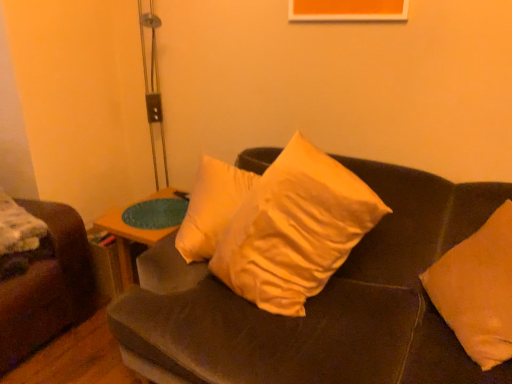
What do you see at coordinates (320, 303) in the screenshot?
I see `velvet brown couch at center` at bounding box center [320, 303].

In order to face orange fabric pillow at right, which is the 1th pillow from right to left, should I rotate leftwards or rightwards?

It's best to rotate right around 29.022 degrees.

Image resolution: width=512 pixels, height=384 pixels. In order to click on soft yellow pillow at center, placed as the 2th pillow when sorted from right to left in this screenshot , I will do `click(295, 229)`.

From the picture: Would you consider metallic silver table lamp at upper left to be distant from woodenwoodentable at center?

metallic silver table lamp at upper left is near woodenwoodentable at center, not far away.

Between point (143, 47) and point (154, 240), which one is positioned behind?

Positioned behind is point (143, 47).

Which object is further away from the camera taking this photo, metallic silver table lamp at upper left or woodenwoodentable at center?

metallic silver table lamp at upper left is behind.

Is orange fabric pillow at right, positioned as the second pillow in left-to-right order, inside the boundaries of metallic silver table lamp at upper left, or outside?

orange fabric pillow at right, positioned as the second pillow in left-to-right order, exists outside the volume of metallic silver table lamp at upper left.

Between orange fabric pillow at right, positioned as the second pillow in left-to-right order, and metallic silver table lamp at upper left, which one appears on the left side from the viewer's perspective?

From the viewer's perspective, metallic silver table lamp at upper left appears more on the left side.

From the image's perspective, is orange fabric pillow at right, positioned as the second pillow in left-to-right order, positioned above or below metallic silver table lamp at upper left?

Based on their image positions, orange fabric pillow at right, positioned as the second pillow in left-to-right order, is located beneath metallic silver table lamp at upper left.

Considering the sizes of objects woodenwoodentable at center and velvet brown couch at center in the image provided, who is wider, woodenwoodentable at center or velvet brown couch at center?

velvet brown couch at center is wider.

Considering the relative sizes of woodenwoodentable at center and velvet brown couch at center in the image provided, is woodenwoodentable at center smaller than velvet brown couch at center?

Indeed, woodenwoodentable at center has a smaller size compared to velvet brown couch at center.

Does point (122, 243) come in front of point (277, 350)?

No, (122, 243) is further to viewer.

Based on the photo, are orange fabric pillow at right, positioned as the second pillow in left-to-right order, and soft yellow pillow at center, placed as the 2th pillow when sorted from right to left, beside each other?

orange fabric pillow at right, positioned as the second pillow in left-to-right order, and soft yellow pillow at center, placed as the 2th pillow when sorted from right to left, are clearly separated.

Is point (502, 239) more distant than point (259, 274)?

No.

Is orange fabric pillow at right, which is the 1th pillow from right to left, not within soft yellow pillow at center, placed as the 2th pillow when sorted from right to left?

Yes, orange fabric pillow at right, which is the 1th pillow from right to left, is outside of soft yellow pillow at center, placed as the 2th pillow when sorted from right to left.

What's the angular difference between velvet brown couch at center and soft yellow pillow at center, the first pillow viewed from the left,'s facing directions?

2.32 degrees.

Considering the relative sizes of velvet brown couch at center and soft yellow pillow at center, placed as the 2th pillow when sorted from right to left, in the image provided, is velvet brown couch at center bigger than soft yellow pillow at center, placed as the 2th pillow when sorted from right to left,?

Yes, velvet brown couch at center is bigger than soft yellow pillow at center, placed as the 2th pillow when sorted from right to left.

Which object is positioned more to the left, velvet brown couch at center or soft yellow pillow at center, the first pillow viewed from the left?

soft yellow pillow at center, the first pillow viewed from the left.

Does velvet brown couch at center have a lesser width compared to soft yellow pillow at center, the first pillow viewed from the left?

In fact, velvet brown couch at center might be wider than soft yellow pillow at center, the first pillow viewed from the left.

Is point (317, 286) less distant than point (138, 238)?

Yes, it is.

From the image's perspective, which is above, soft yellow pillow at center, the first pillow viewed from the left, or woodenwoodentable at center?

soft yellow pillow at center, the first pillow viewed from the left, is shown above in the image.

Identify the location of table behind the soft yellow pillow at center, the first pillow viewed from the left. Image resolution: width=512 pixels, height=384 pixels. (129, 240).

Could you tell me if soft yellow pillow at center, the first pillow viewed from the left, is facing woodenwoodentable at center?

No.

From the image's perspective, does orange fabric pillow at right, positioned as the second pillow in left-to-right order, appear lower than velvet brown couch at center?

No.

Is orange fabric pillow at right, positioned as the second pillow in left-to-right order, positioned with its back to velvet brown couch at center?

Correct, orange fabric pillow at right, positioned as the second pillow in left-to-right order, is looking away from velvet brown couch at center.

Which of these two, orange fabric pillow at right, positioned as the second pillow in left-to-right order, or velvet brown couch at center, is wider?

velvet brown couch at center is wider.

Find the location of a particular element. The image size is (512, 384). table lamp on the left of the woodenwoodentable at center is located at coordinates (154, 101).

From the metallic silver table lamp at upper left, count 2nd pillows forward and point to it. Please provide its 2D coordinates.

[(478, 290)]

Considering their positions, is velvet brown couch at center positioned closer to metallic silver table lamp at upper left than woodenwoodentable at center?

woodenwoodentable at center lies closer to metallic silver table lamp at upper left than the other object.

From the picture: From the image, which object appears to be nearer to soft yellow pillow at center, placed as the 2th pillow when sorted from right to left, metallic silver table lamp at upper left or woodenwoodentable at center?

The object closer to soft yellow pillow at center, placed as the 2th pillow when sorted from right to left, is woodenwoodentable at center.

When comparing their distances from woodenwoodentable at center, does orange fabric pillow at right, which is the 1th pillow from right to left, or metallic silver table lamp at upper left seem further?

orange fabric pillow at right, which is the 1th pillow from right to left, is further to woodenwoodentable at center.

Based on their spatial positions, is woodenwoodentable at center or soft yellow pillow at center, the first pillow viewed from the left, further from velvet brown couch at center?

The object further to velvet brown couch at center is woodenwoodentable at center.

From the picture: From the image, which object appears to be nearer to metallic silver table lamp at upper left, woodenwoodentable at center or orange fabric pillow at right, which is the 1th pillow from right to left?

Based on the image, woodenwoodentable at center appears to be nearer to metallic silver table lamp at upper left.

Estimate the real-world distances between objects in this image. Which object is closer to orange fabric pillow at right, which is the 1th pillow from right to left, metallic silver table lamp at upper left or soft yellow pillow at center, the first pillow viewed from the left?

Based on the image, soft yellow pillow at center, the first pillow viewed from the left, appears to be nearer to orange fabric pillow at right, which is the 1th pillow from right to left.

Considering their positions, is soft yellow pillow at center, the first pillow viewed from the left, positioned further to woodenwoodentable at center than orange fabric pillow at right, positioned as the second pillow in left-to-right order?

orange fabric pillow at right, positioned as the second pillow in left-to-right order, is positioned further to the anchor woodenwoodentable at center.

When comparing their distances from orange fabric pillow at right, which is the 1th pillow from right to left, does velvet brown couch at center or metallic silver table lamp at upper left seem closer?

Based on the image, velvet brown couch at center appears to be nearer to orange fabric pillow at right, which is the 1th pillow from right to left.

Find the location of a particular element. table between metallic silver table lamp at upper left and orange fabric pillow at right, positioned as the second pillow in left-to-right order, in the horizontal direction is located at coordinates (x=129, y=240).

Identify the location of table positioned between soft yellow pillow at center, placed as the 2th pillow when sorted from right to left, and metallic silver table lamp at upper left from near to far. pos(129,240).

Locate an element on the screen. The image size is (512, 384). studio couch between woodenwoodentable at center and orange fabric pillow at right, which is the 1th pillow from right to left, in the horizontal direction is located at coordinates (320, 303).

Locate an element on the screen. Image resolution: width=512 pixels, height=384 pixels. studio couch located between metallic silver table lamp at upper left and orange fabric pillow at right, which is the 1th pillow from right to left, in the left-right direction is located at coordinates pyautogui.click(x=320, y=303).